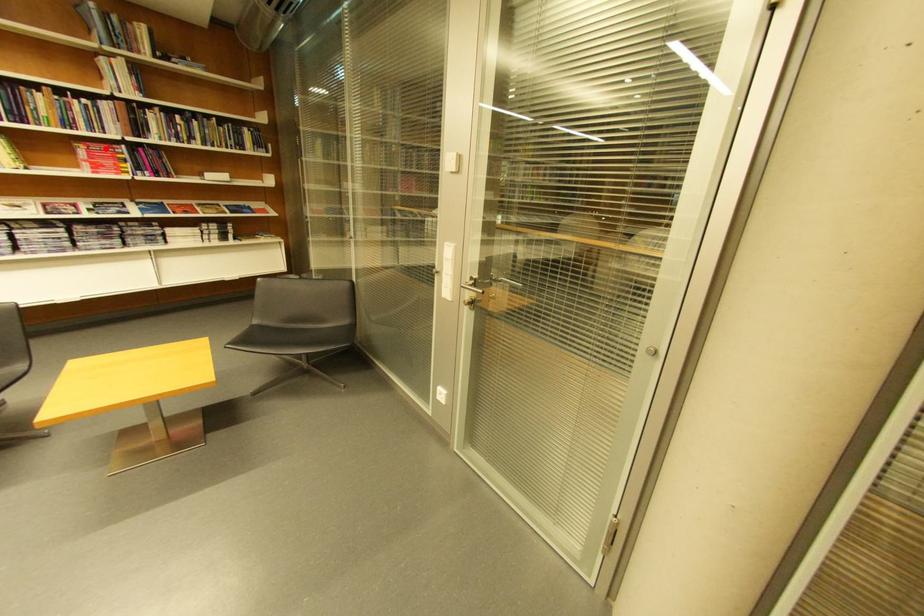
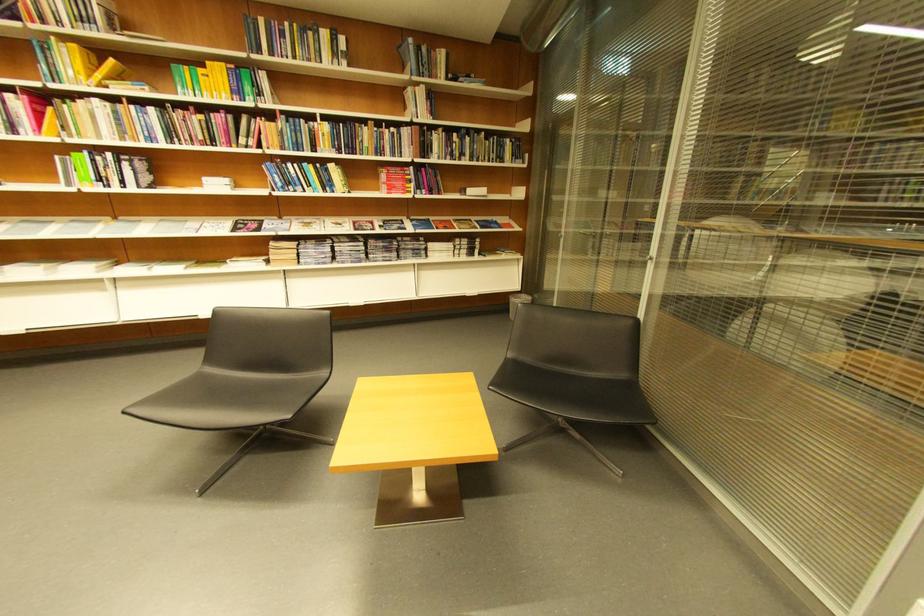
Locate, in the second image, the point that corresponds to the highlighted location in the first image.

(403, 172)